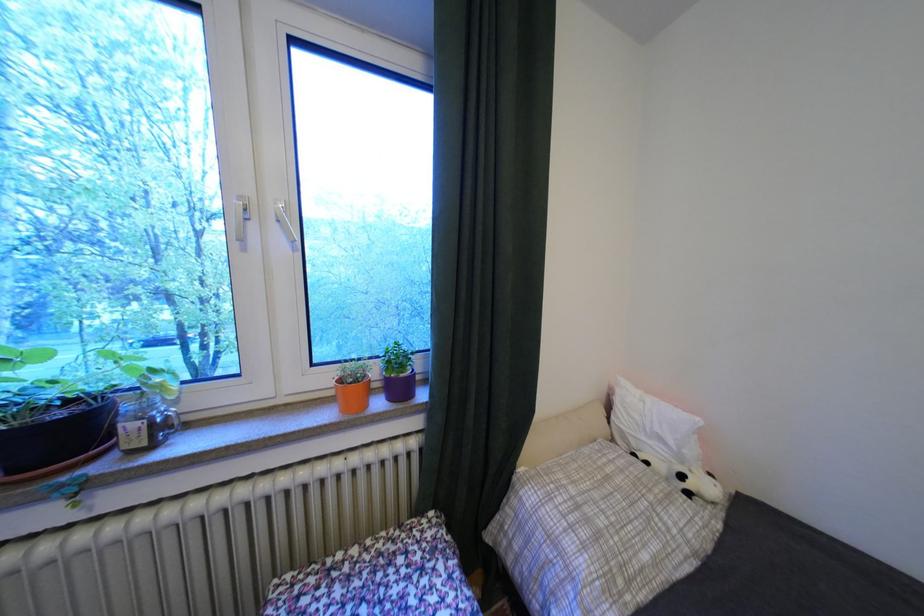
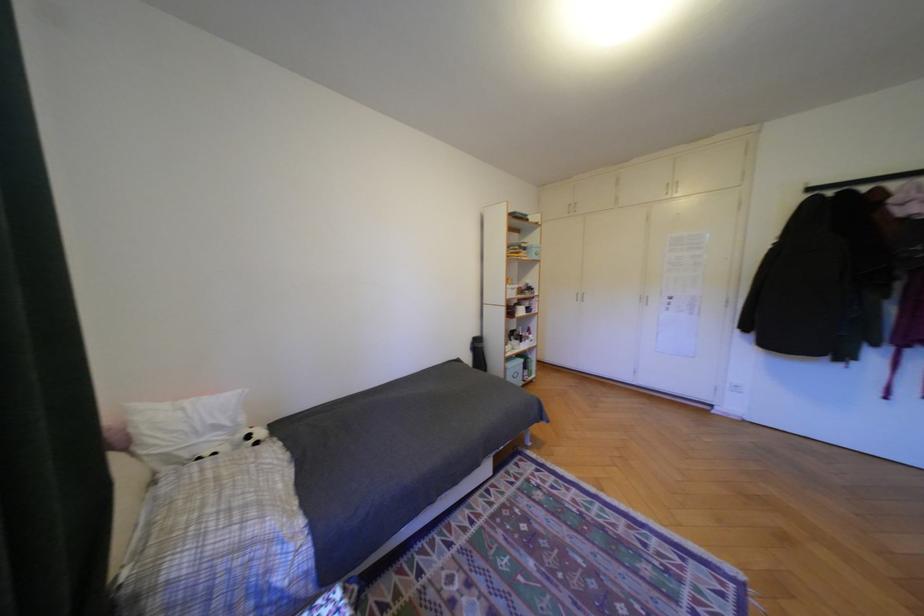
Where in the second image is the point corresponding to (x=694, y=477) from the first image?

(261, 437)